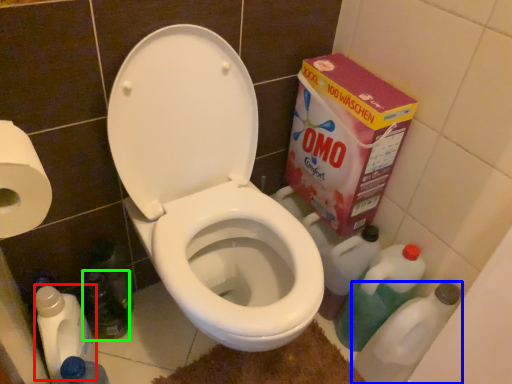
Question: Considering the real-world distances, which object is closest to cleaning product (highlighted by a red box)? cleaning product (highlighted by a blue box) or bottle (highlighted by a green box).

Choices:
 (A) cleaning product
 (B) bottle

Answer: (B)